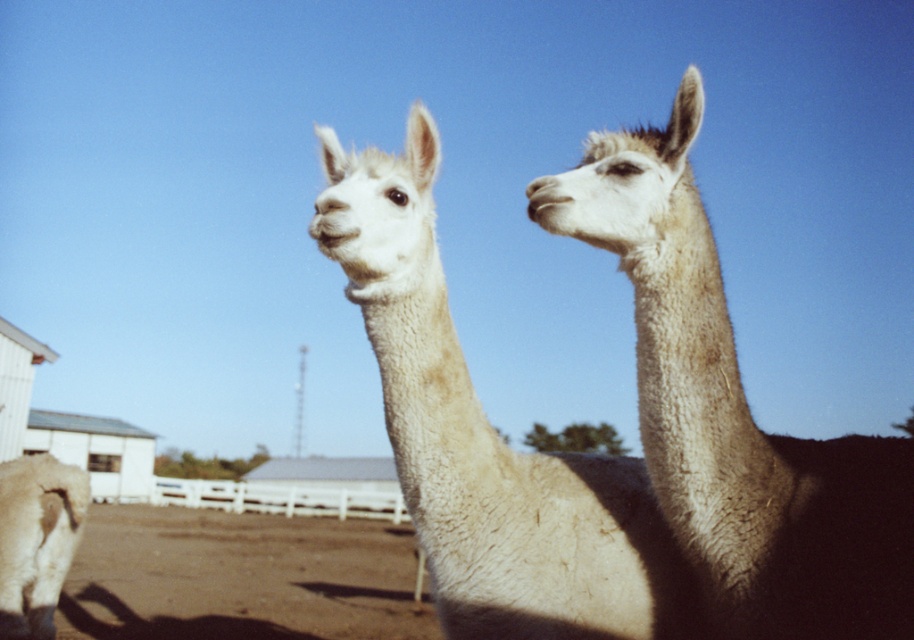
Question: Estimate the real-world distances between objects in this image. Which object is closer to the brown dirt field at lower center?

Choices:
 (A) white woolen alpaca at center
 (B) white woolen alpaca at upper right

Answer: (A)

Question: Among these objects, which one is farthest from the camera?

Choices:
 (A) white woolen alpaca at upper right
 (B) white woolen alpaca at center

Answer: (B)

Question: Which of the following is the farthest from the observer?

Choices:
 (A) white woolen alpaca at upper right
 (B) white woolen alpaca at center

Answer: (B)

Question: Does white woolen alpaca at center have a greater width compared to brown dirt field at lower center?

Choices:
 (A) yes
 (B) no

Answer: (B)

Question: Is white woolen alpaca at upper right positioned before brown dirt field at lower center?

Choices:
 (A) no
 (B) yes

Answer: (B)

Question: Is white woolen alpaca at upper right above white woolen alpaca at center?

Choices:
 (A) no
 (B) yes

Answer: (B)